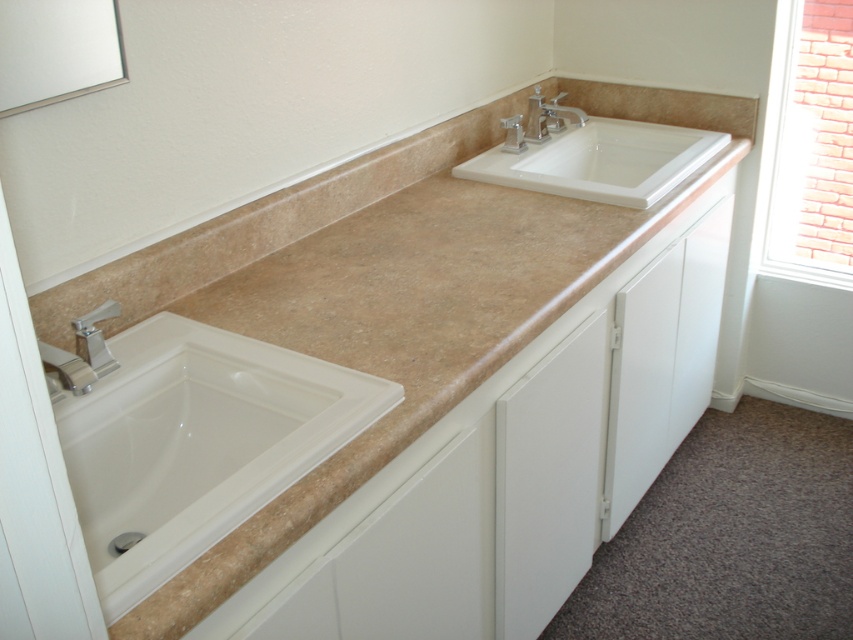
You are standing in front of the bathroom vanity and want to place a decorative item between the two points, point (206, 388) and point (103, 355). To ensure it is placed correctly, which point should the item be closer to in order to be positioned between them?

The decorative item should be placed closer to point (103, 355) because point (206, 388) is behind point (103, 355), so the midpoint between them would be closer to the front point.